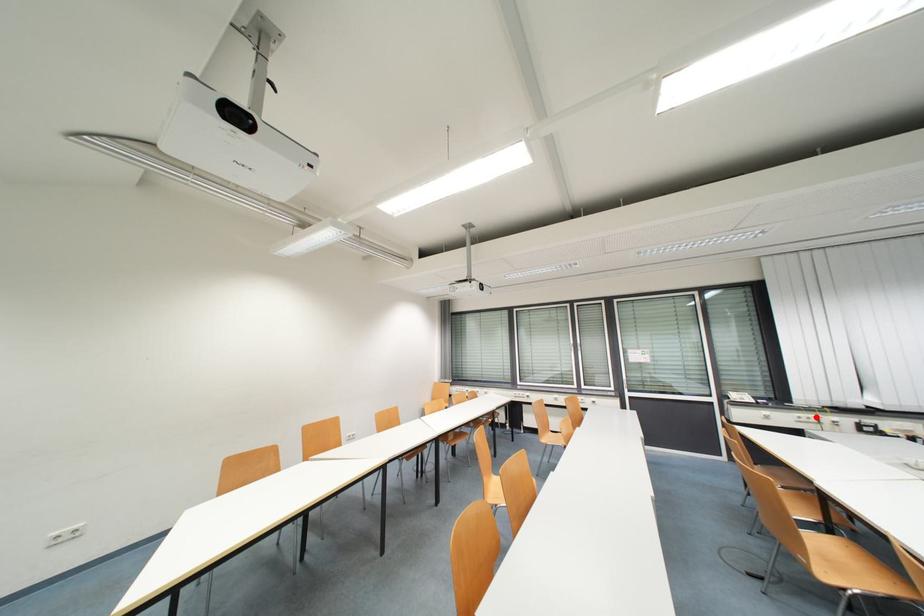
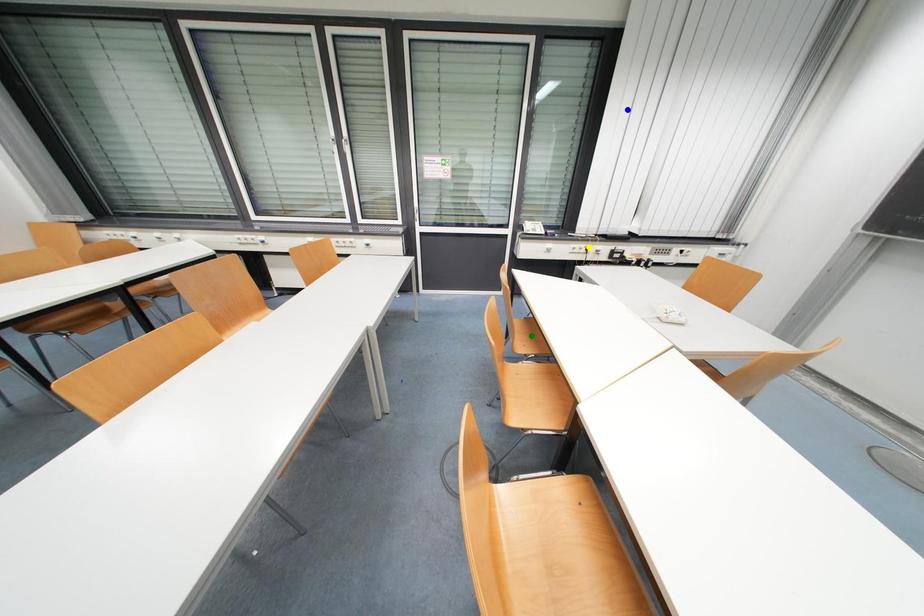
Question: I am providing you with two images of the same scene from different viewpoints. A red point is marked on the first image. You are given multiple points on the second image. In image 2, which mark is for the same physical point as the one in image 1?

Choices:
 (A) blue point
 (B) yellow point
 (C) green point

Answer: (B)